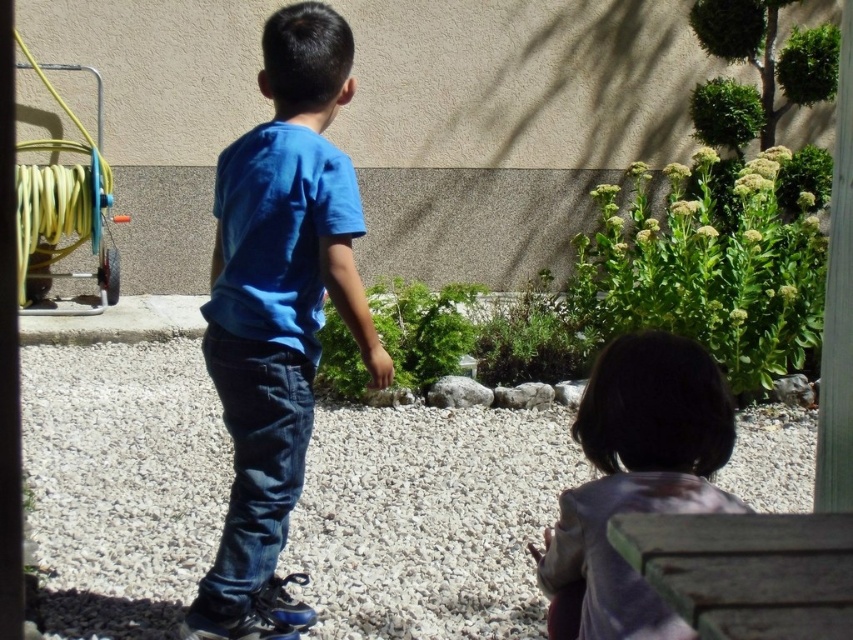
What do you see at coordinates (428, 518) in the screenshot? This screenshot has width=853, height=640. I see `white gravel at center` at bounding box center [428, 518].

Between white gravel at center and purple fabric at lower right, which one appears on the right side from the viewer's perspective?

From the viewer's perspective, purple fabric at lower right appears more on the right side.

The width and height of the screenshot is (853, 640). Identify the location of white gravel at center. (428, 518).

Is purple fabric at lower right wider than dark blue denim jeans at center?

No.

Is purple fabric at lower right in front of dark blue denim jeans at center?

That is True.

What do you see at coordinates (635, 481) in the screenshot?
I see `purple fabric at lower right` at bounding box center [635, 481].

Where is `purple fabric at lower right`? purple fabric at lower right is located at coordinates (635, 481).

Between blue cotton shirt at center and purple fabric at lower right, which one has less height?

purple fabric at lower right

What do you see at coordinates (277, 312) in the screenshot?
I see `blue cotton shirt at center` at bounding box center [277, 312].

At what (x,y) coordinates should I click in order to perform the action: click on blue cotton shirt at center. Please return your answer as a coordinate pair (x, y). The height and width of the screenshot is (640, 853). Looking at the image, I should click on (277, 312).